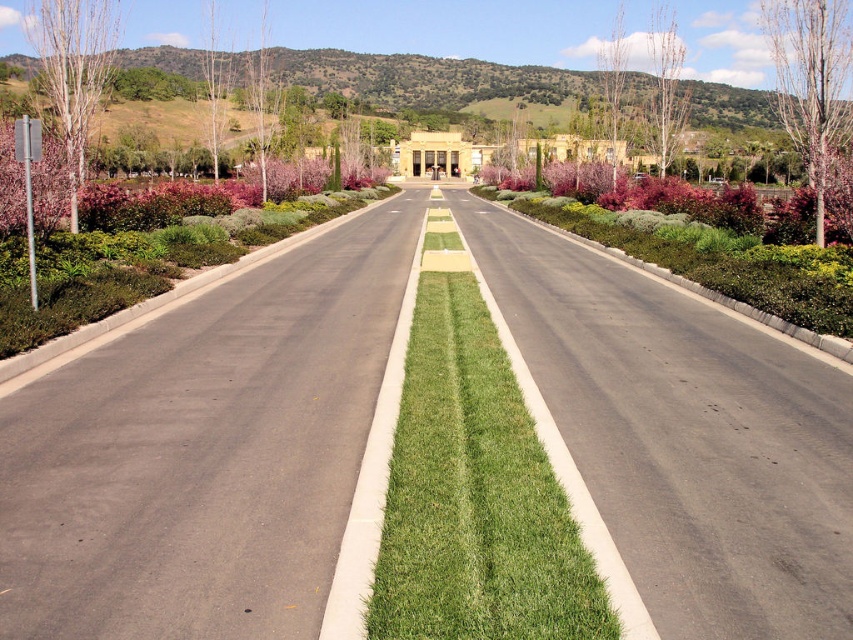
You are a photographer standing at the center of the road. You want to take a photo that includes both the bare bark tree at upper right and the bare white tree at upper left. Which tree should you position closer to the camera to ensure both are in the frame?

The bare bark tree at upper right is in front of the bare white tree at upper left, so positioning the bare bark tree at upper right closer to the camera will ensure both trees are visible in the frame.

You are standing at the center of the road and looking towards the large building in the background. You notice two points marked on the road surface. Which of the two points, point [669,109] or point [218,19], is closer to your current position?

Point [669,109] is closer to the camera than point [218,19], so the point closer to your current position is point [669,109].